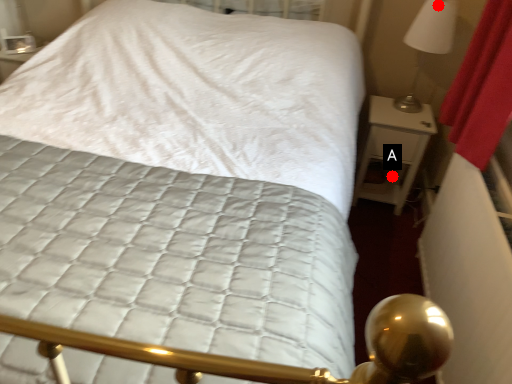
Question: Two points are circled on the image, labeled by A and B beside each circle. Which point is farther from the camera taking this photo?

Choices:
 (A) A is further
 (B) B is further

Answer: (A)